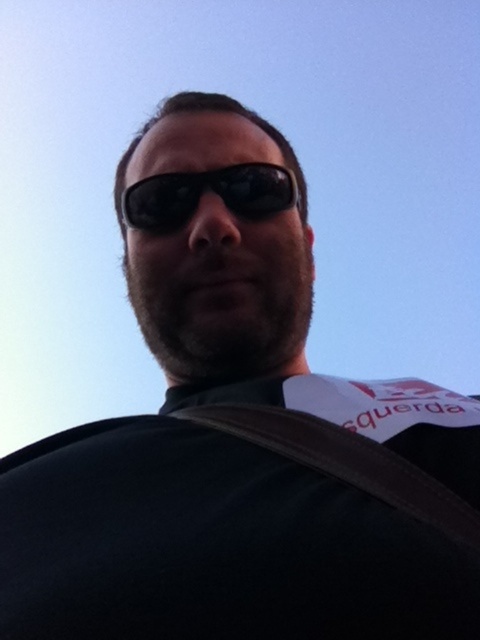
Question: Is brown leather strap at lower center to the left of black reflective sunglasses at center from the viewer's perspective?

Choices:
 (A) no
 (B) yes

Answer: (A)

Question: Which point is closer to the camera taking this photo?

Choices:
 (A) (278, 168)
 (B) (344, 436)

Answer: (B)

Question: Which object is closer to the camera taking this photo?

Choices:
 (A) brown leather strap at lower center
 (B) black reflective sunglasses at center

Answer: (A)

Question: Is brown leather strap at lower center thinner than black reflective sunglasses at center?

Choices:
 (A) no
 (B) yes

Answer: (B)

Question: Does brown leather strap at lower center appear over black reflective sunglasses at center?

Choices:
 (A) no
 (B) yes

Answer: (A)